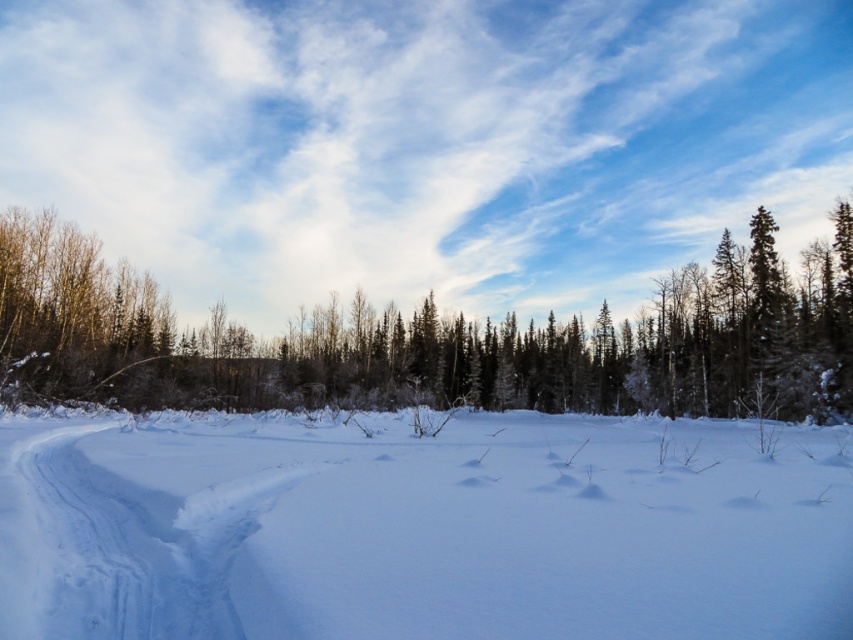
Question: Does white fluffy snow at center have a lesser width compared to snowy evergreen trees at center?

Choices:
 (A) no
 (B) yes

Answer: (B)

Question: Considering the relative positions of white fluffy snow at center and snowy evergreen trees at center in the image provided, where is white fluffy snow at center located with respect to snowy evergreen trees at center?

Choices:
 (A) below
 (B) above

Answer: (A)

Question: Where is white fluffy snow at center located in relation to snowy evergreen trees at center in the image?

Choices:
 (A) right
 (B) left

Answer: (B)

Question: Which point is closer to the camera?

Choices:
 (A) (563, 589)
 (B) (543, 403)

Answer: (A)